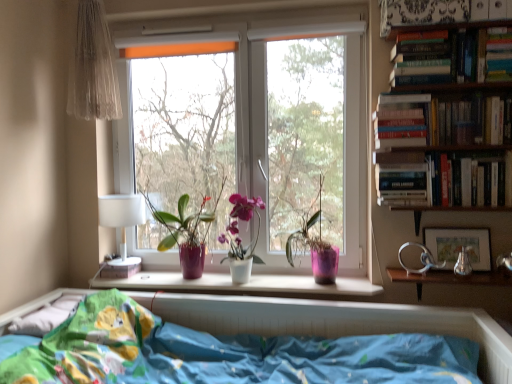
Question: Should I look upward or downward to see hardcover book at upper right, which is the 3th paperback book from top to bottom?

Choices:
 (A) down
 (B) up

Answer: (B)

Question: Can you confirm if hardcover book at upper right, which is the 1th book in top-to-bottom order, is positioned to the right of white fabric lampshade at left?

Choices:
 (A) yes
 (B) no

Answer: (A)

Question: Could white fabric lampshade at left be considered to be inside hardcover book at upper right, which is the 4th book in bottom-to-top order?

Choices:
 (A) no
 (B) yes

Answer: (A)

Question: Could you tell me if hardcover book at upper right, which is the 1th book in top-to-bottom order, is facing white fabric lampshade at left?

Choices:
 (A) no
 (B) yes

Answer: (A)

Question: Is hardcover book at upper right, which is the 4th book in bottom-to-top order, at the left side of white fabric lampshade at left?

Choices:
 (A) yes
 (B) no

Answer: (B)

Question: Is hardcover book at upper right, which is the 1th book in top-to-bottom order, behind white fabric lampshade at left?

Choices:
 (A) no
 (B) yes

Answer: (A)

Question: Can you confirm if hardcover book at upper right, which is the 4th book in bottom-to-top order, is wider than white fabric lampshade at left?

Choices:
 (A) yes
 (B) no

Answer: (A)

Question: Does hardcover book at upper right, which appears as the second paperback book when ordered from the bottom, come in front of white glossy pot at center, the 2th houseplant viewed from the left?

Choices:
 (A) no
 (B) yes

Answer: (B)

Question: Is hardcover book at upper right, which is counted as the 2th paperback book, starting from the left, smaller than white glossy pot at center, the 2th houseplant viewed from the left?

Choices:
 (A) no
 (B) yes

Answer: (B)

Question: Considering the relative positions of hardcover book at upper right, acting as the 2th paperback book starting from the top, and white glossy pot at center, acting as the second houseplant starting from the right, in the image provided, is hardcover book at upper right, acting as the 2th paperback book starting from the top, to the left of white glossy pot at center, acting as the second houseplant starting from the right, from the viewer's perspective?

Choices:
 (A) no
 (B) yes

Answer: (A)

Question: Can white glossy pot at center, the 2th houseplant viewed from the left, be found inside hardcover book at upper right, which appears as the second paperback book when ordered from the bottom?

Choices:
 (A) no
 (B) yes

Answer: (A)

Question: Is hardcover book at upper right, which appears as the second paperback book when ordered from the bottom, outside white glossy pot at center, acting as the second houseplant starting from the right?

Choices:
 (A) no
 (B) yes

Answer: (B)

Question: From a real-world perspective, is hardcover book at upper right, which appears as the second paperback book when ordered from the bottom, beneath white glossy pot at center, acting as the second houseplant starting from the right?

Choices:
 (A) yes
 (B) no

Answer: (B)

Question: Can you confirm if translucent fabric curtain at upper left is taller than blue fabric bed at lower center?

Choices:
 (A) yes
 (B) no

Answer: (A)